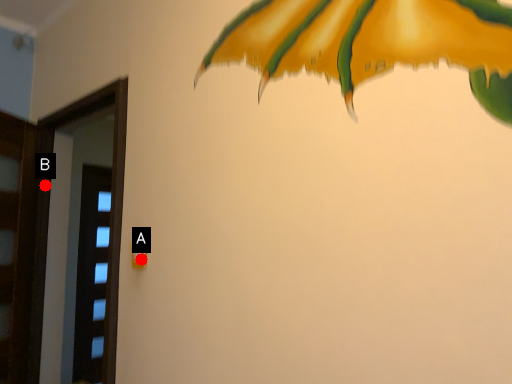
Question: Two points are circled on the image, labeled by A and B beside each circle. Which point is farther from the camera taking this photo?

Choices:
 (A) A is further
 (B) B is further

Answer: (B)